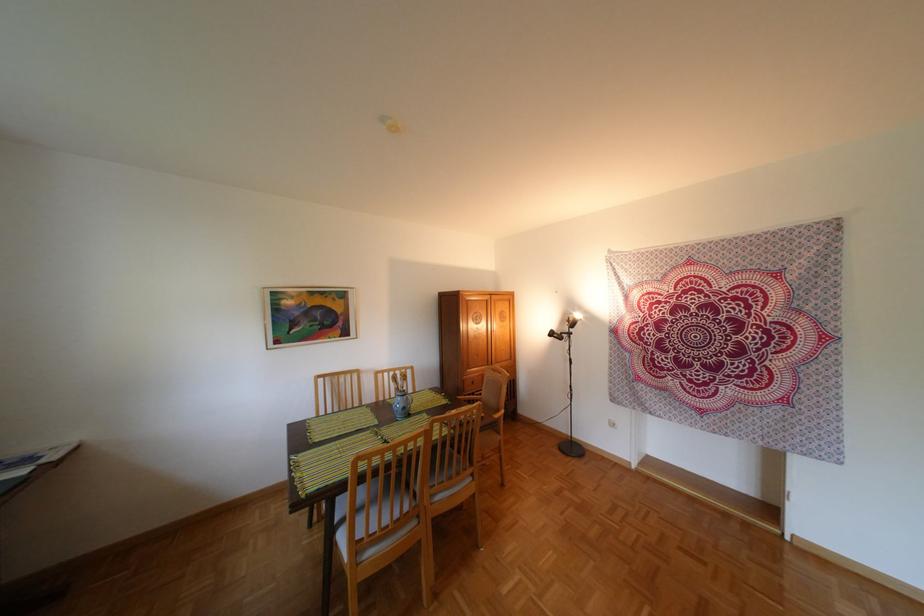
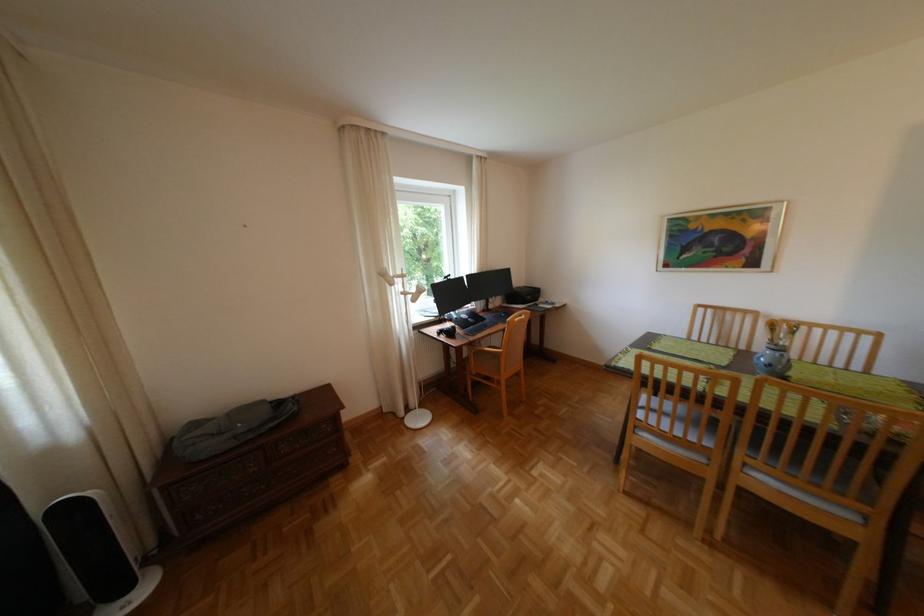
In the second image, find the point that corresponds to (x=417, y=408) in the first image.

(782, 365)